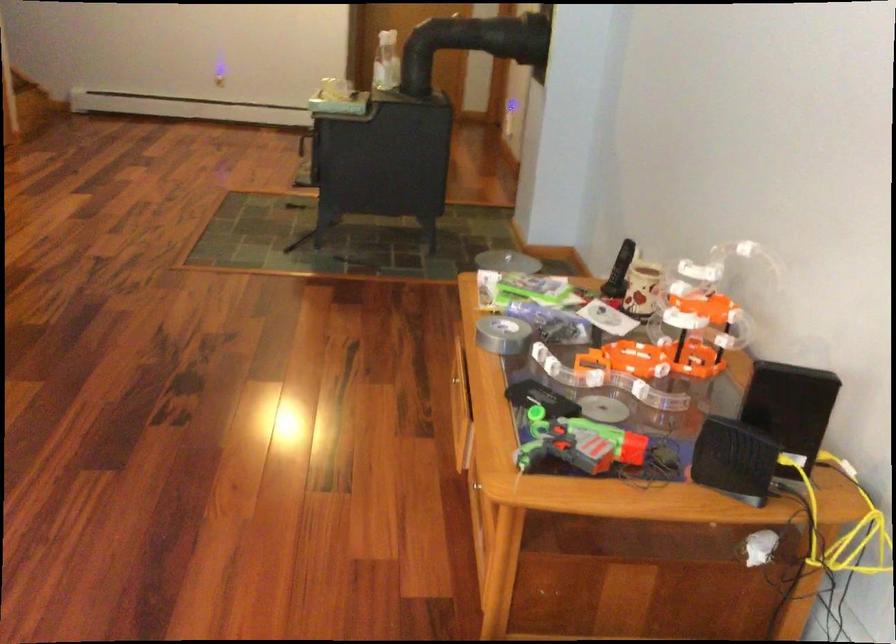
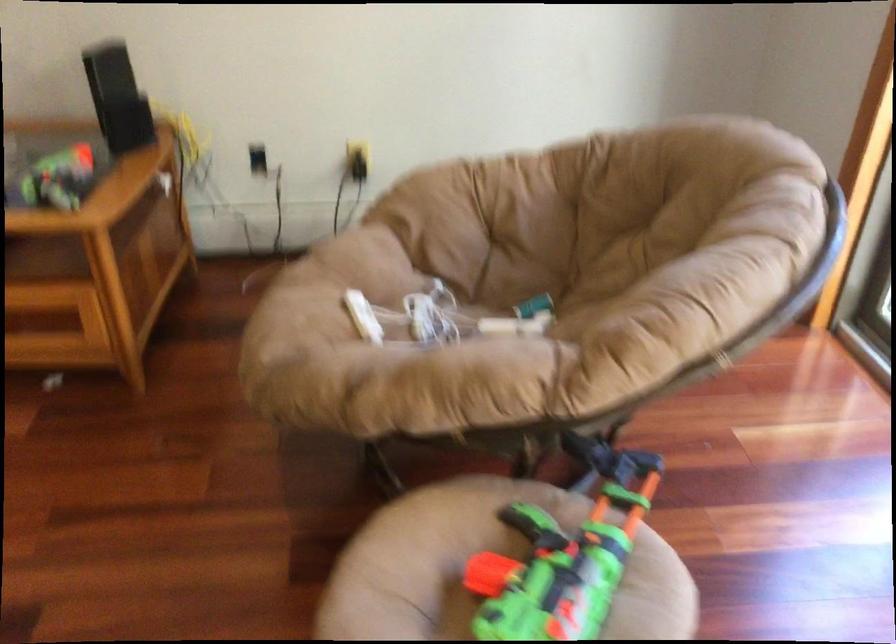
Where in the second image is the point corresponding to [503,534] from the first image?

(95, 263)